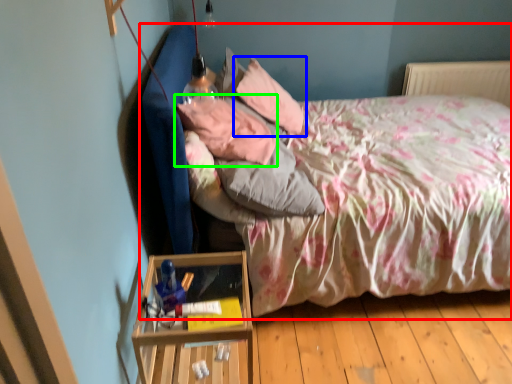
Question: Based on their relative distances, which object is farther from bed (highlighted by a red box)? Choose from pillow (highlighted by a blue box) and pillow (highlighted by a green box).

Choices:
 (A) pillow
 (B) pillow

Answer: (A)